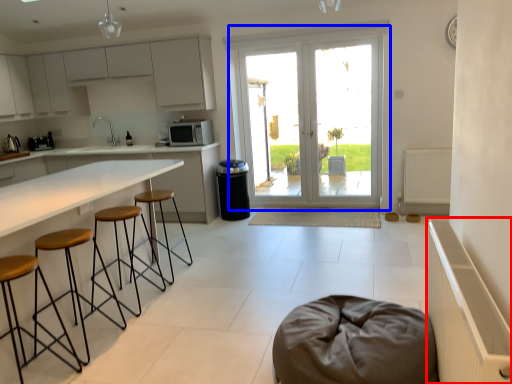
Question: Which of the following is the closest to the observer, radiator (highlighted by a red box) or door (highlighted by a blue box)?

Choices:
 (A) radiator
 (B) door

Answer: (A)